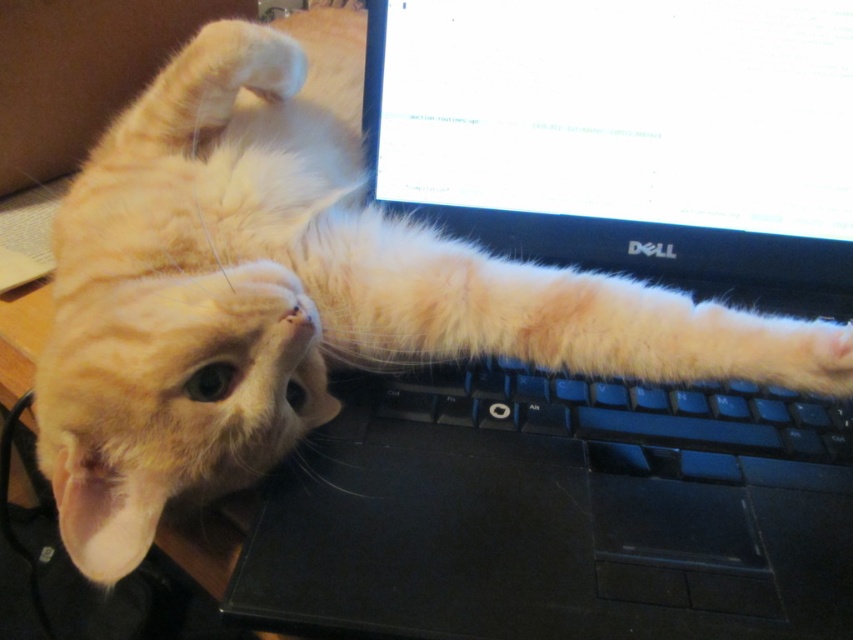
Question: Is white glossy screen at upper center above orange fur at upper left?

Choices:
 (A) yes
 (B) no

Answer: (B)

Question: Does white glossy screen at upper center have a larger size compared to orange fur at upper left?

Choices:
 (A) yes
 (B) no

Answer: (B)

Question: Is white glossy screen at upper center below black plastic keyboard at center?

Choices:
 (A) no
 (B) yes

Answer: (A)

Question: Which point is farther from the camera taking this photo?

Choices:
 (A) (788, 410)
 (B) (764, 6)

Answer: (B)

Question: Which point is farther from the camera taking this photo?

Choices:
 (A) (454, 413)
 (B) (830, 266)

Answer: (B)

Question: Which point is farther to the camera?

Choices:
 (A) (48, 8)
 (B) (561, 84)

Answer: (A)